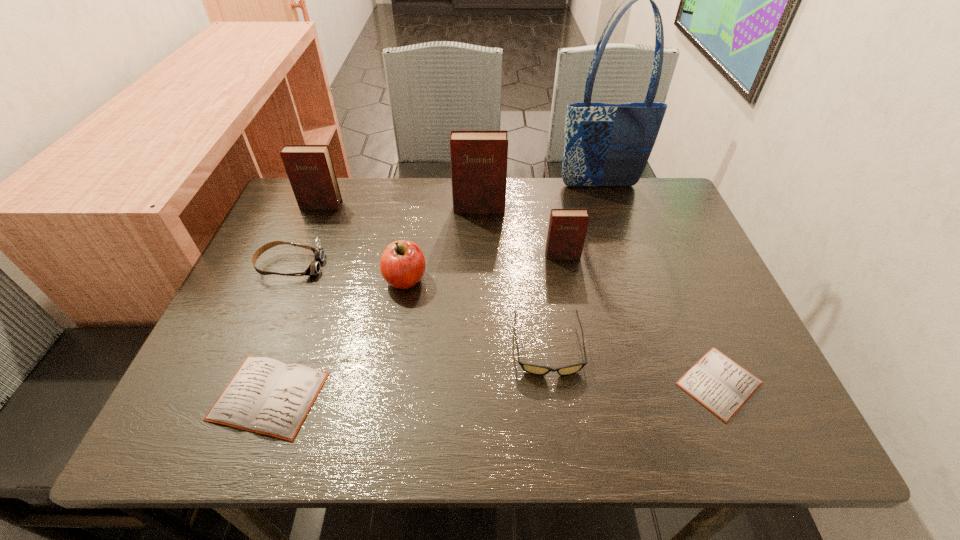
This screenshot has height=540, width=960. I want to click on the farthest object, so click(605, 144).

Where is `the tallest object`? the tallest object is located at coordinates (605, 144).

You are a GUI agent. You are given a task and a screenshot of the screen. Output one action in this format:
    pyautogui.click(x=<x>, y=<y>)
    Task: Click on the second reddish-brown diary from right to left
    The image size is (960, 540).
    Given the screenshot: What is the action you would take?
    pyautogui.click(x=478, y=158)

Identify the location of the third diary from right to left. This screenshot has width=960, height=540. (478, 158).

Where is `the second biggest reddish-brown diary`? The width and height of the screenshot is (960, 540). the second biggest reddish-brown diary is located at coordinates (310, 170).

Locate an element on the screen. This screenshot has width=960, height=540. the seventh shortest object is located at coordinates (310, 170).

Where is `the third nearest diary`? the third nearest diary is located at coordinates (567, 229).

Image resolution: width=960 pixels, height=540 pixels. I want to click on the fourth tallest object, so click(x=567, y=229).

Where is `apple`? apple is located at coordinates (402, 265).

The height and width of the screenshot is (540, 960). What are the coordinates of `the fifth tallest object` in the screenshot? It's located at (402, 265).